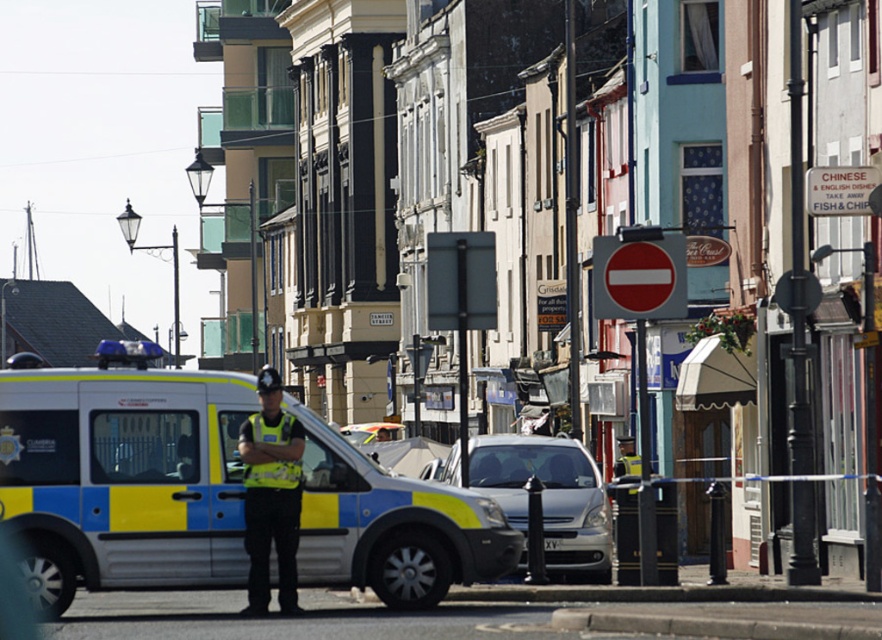
You are a pedestrian standing on the sidewalk in the street scene. You notice two points marked on the buildings in the background. Which point, point 1 at coordinates (445, 483) or point 2 at coordinates (613, 262), is closer to you?

Point 1 at coordinates (445, 483) is closer to you because it is further to the viewer than point 2 at coordinates (613, 262).

You are a delivery driver who needs to park your vehicle in a spot that is exactly at coordinates 0.769, 0.246. The yellow and blue van at center is currently occupying that spot. Can you park your vehicle there?

The yellow and blue van at center is already occupying the spot at coordinates (215, 492), so you cannot park your vehicle there.